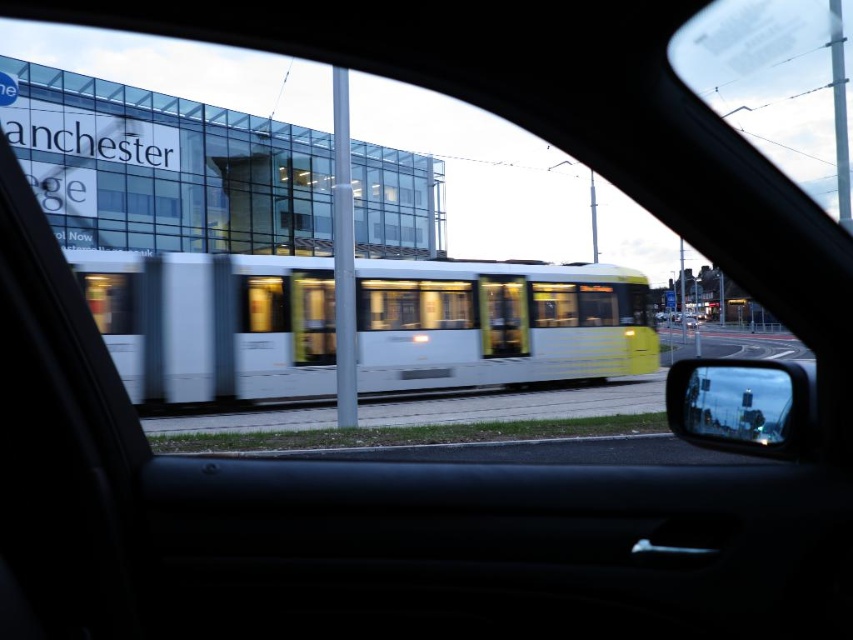
You are a passenger in a car and notice both the white glossy train at center and the reflective glass mirror at right outside your window. Which object appears larger in size from your current viewpoint?

The reflective glass mirror at right appears larger than the white glossy train at center because the description states that the white glossy train at center is smaller than the reflective glass mirror at right.

You are a passenger sitting in the car and looking out the window. You notice the white glossy train at center and the reflective glass mirror at right. Which object is positioned higher from the ground?

The white glossy train at center is located above the reflective glass mirror at right, so it is positioned higher from the ground.